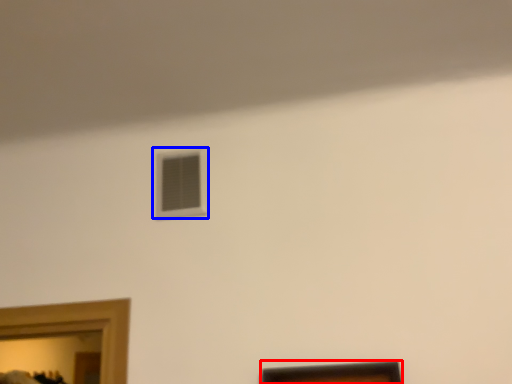
Question: Which point is closer to the camera, picture frame (highlighted by a red box) or window (highlighted by a blue box)?

Choices:
 (A) picture frame
 (B) window

Answer: (A)